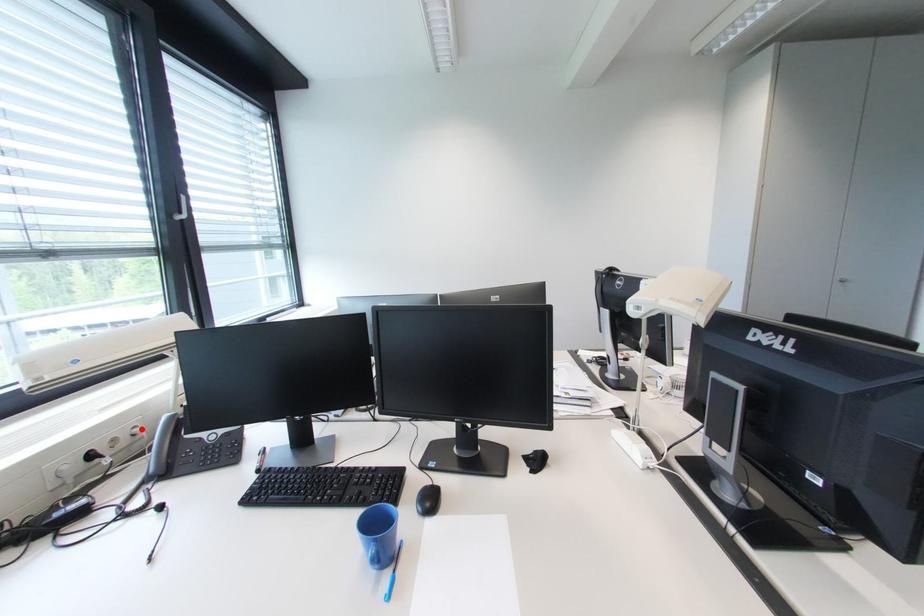
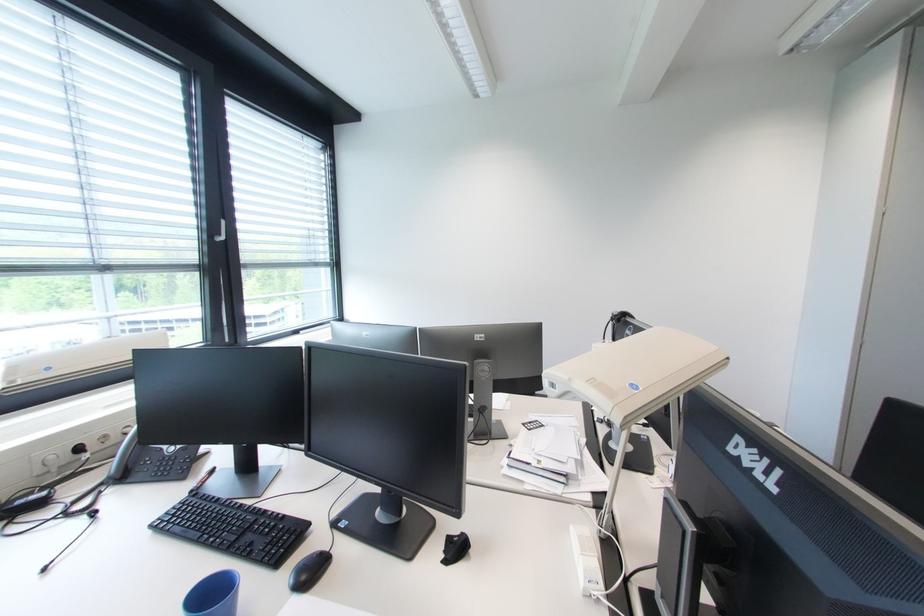
The point at the highlighted location is marked in the first image. Where is the corresponding point in the second image?

(134, 428)